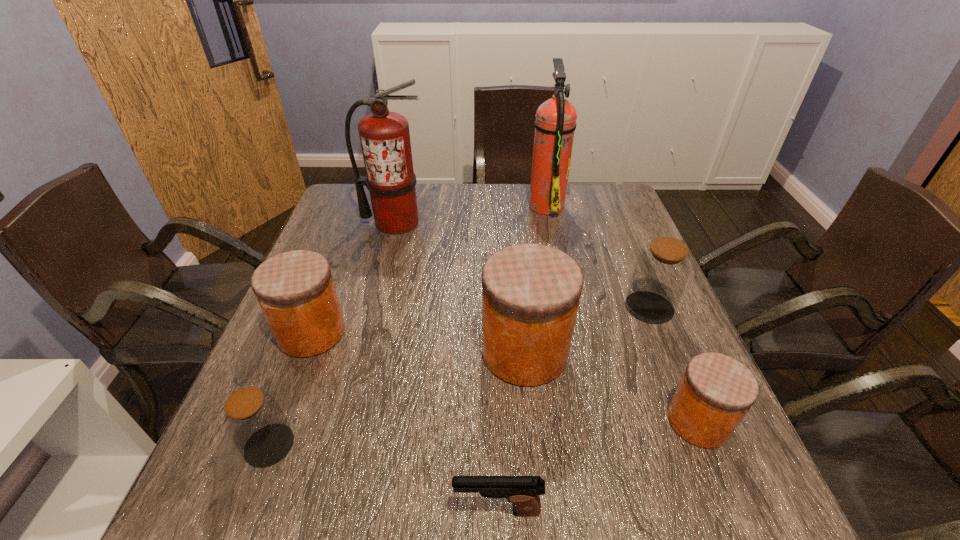
The height and width of the screenshot is (540, 960). What are the coordinates of `vacant region located 0.060m on the left of the rightmost orange jar` in the screenshot? It's located at (636, 421).

This screenshot has height=540, width=960. I want to click on vacant space situated on the right of the left brown jar, so click(x=420, y=445).

Locate an element on the screen. free region located 0.390m at the barrel of the black pistol is located at coordinates [x=211, y=510].

The height and width of the screenshot is (540, 960). Identify the location of vacant space situated 0.220m at the barrel of the black pistol. (317, 510).

The image size is (960, 540). I want to click on free spot located 0.240m at the barrel of the black pistol, so click(304, 510).

The image size is (960, 540). Find the location of `object positioned at the near edge`. object positioned at the near edge is located at coordinates (523, 491).

Identify the location of fire extinguisher situated at the left edge. Image resolution: width=960 pixels, height=540 pixels. (385, 138).

What are the coordinates of `object that is positioned at the far left corner` in the screenshot? It's located at (385, 138).

Where is `vacant space at the far edge of the desktop`? The width and height of the screenshot is (960, 540). vacant space at the far edge of the desktop is located at coordinates (569, 213).

You are a GUI agent. You are given a task and a screenshot of the screen. Output one action in this format:
    pyautogui.click(x=<x>, y=<y>)
    Task: Click on the free spot at the near edge of the desktop
    
    Given the screenshot: What is the action you would take?
    pyautogui.click(x=375, y=522)